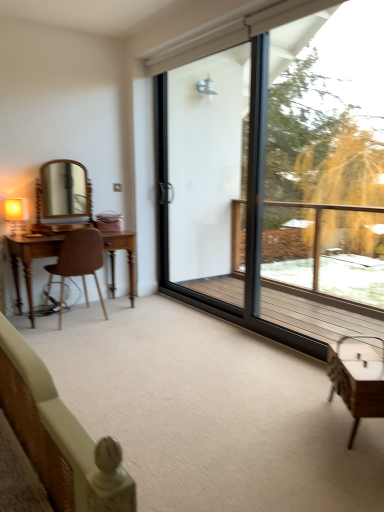
At what (x,y) coordinates should I click in order to perform the action: click on free space between wooden desk at left, the first table in the back-to-front sequence, and white glossy table at lower right, which is the 1th table from right to left. Please return your answer as a coordinate pair (x, y). The width and height of the screenshot is (384, 512). Looking at the image, I should click on (200, 354).